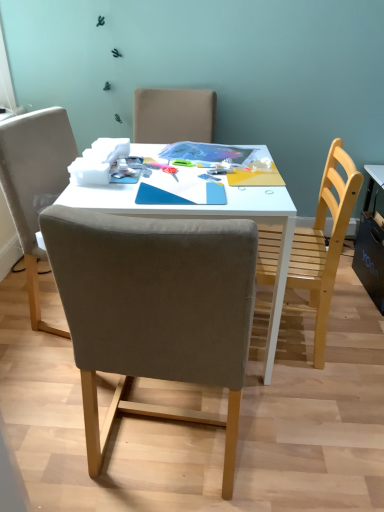
The image size is (384, 512). What do you see at coordinates (210, 218) in the screenshot? I see `white glossy table at center` at bounding box center [210, 218].

Identify the location of wooden chair at right, the 1th chair viewed from the right. Image resolution: width=384 pixels, height=512 pixels. (324, 242).

From the picture: From the image's perspective, which is above, wooden chair at right, the 1th chair viewed from the right, or white glossy table at center?

wooden chair at right, the 1th chair viewed from the right, appears higher in the image.

From a real-world perspective, is wooden chair at right, positioned as the second chair in left-to-right order, positioned over white glossy table at center based on gravity?

Yes, from a real-world perspective, wooden chair at right, positioned as the second chair in left-to-right order, is above white glossy table at center.

In the image, there is a wooden chair at right, positioned as the second chair in left-to-right order. Where is `table below it (from the image's perspective)`? table below it (from the image's perspective) is located at coordinates (210, 218).

Considering the relative positions of white glossy table at center and wooden chair at right, the 1th chair viewed from the right, in the image provided, is white glossy table at center to the left of wooden chair at right, the 1th chair viewed from the right, from the viewer's perspective?

Indeed, white glossy table at center is positioned on the left side of wooden chair at right, the 1th chair viewed from the right.

Is white glossy table at center completely or partially outside of wooden chair at right, the 1th chair viewed from the right?

That's correct, white glossy table at center is outside of wooden chair at right, the 1th chair viewed from the right.

Considering the sizes of objects white glossy table at center and wooden chair at right, the 1th chair viewed from the right, in the image provided, who is taller, white glossy table at center or wooden chair at right, the 1th chair viewed from the right,?

With more height is wooden chair at right, the 1th chair viewed from the right.

Is white glossy table at center smaller than wooden chair at right, the 1th chair viewed from the right?

No.

Is suede-like beige chair at center, which is the second chair from right to left, in front of white glossy table at center?

Yes, it is.

Do you think suede-like beige chair at center, acting as the 1th chair starting from the left, is within white glossy table at center, or outside of it?

suede-like beige chair at center, acting as the 1th chair starting from the left, exists outside the volume of white glossy table at center.

In terms of size, does suede-like beige chair at center, which is the second chair from right to left, appear bigger or smaller than white glossy table at center?

Clearly, suede-like beige chair at center, which is the second chair from right to left, is smaller in size than white glossy table at center.

Which object is positioned more to the left, suede-like beige chair at center, which is the second chair from right to left, or white glossy table at center?

suede-like beige chair at center, which is the second chair from right to left.

Would you say wooden chair at right, positioned as the second chair in left-to-right order, contains suede-like beige chair at center, which is the second chair from right to left?

No, suede-like beige chair at center, which is the second chair from right to left, is not surrounded by wooden chair at right, positioned as the second chair in left-to-right order.

Between wooden chair at right, positioned as the second chair in left-to-right order, and suede-like beige chair at center, which is the second chair from right to left, which one has larger size?

With larger size is suede-like beige chair at center, which is the second chair from right to left.

Is wooden chair at right, the 1th chair viewed from the right, oriented away from suede-like beige chair at center, which is the second chair from right to left?

No, suede-like beige chair at center, which is the second chair from right to left, is not at the back of wooden chair at right, the 1th chair viewed from the right.

How distant is wooden chair at right, positioned as the second chair in left-to-right order, from suede-like beige chair at center, which is the second chair from right to left?

They are 26.28 inches apart.

Can you tell me how much white glossy table at center and suede-like beige chair at center, which is the second chair from right to left, differ in facing direction?

There is a 172-degree angle between the facing directions of white glossy table at center and suede-like beige chair at center, which is the second chair from right to left.

Looking at this image, between white glossy table at center and suede-like beige chair at center, acting as the 1th chair starting from the left, which one has more height?

With more height is suede-like beige chair at center, acting as the 1th chair starting from the left.

From a real-world perspective, which object rests below the other?

white glossy table at center.

Considering the points (153, 145) and (115, 319), which point is in front, point (153, 145) or point (115, 319)?

Point (115, 319)

From the image's perspective, is suede-like beige chair at center, acting as the 1th chair starting from the left, located beneath wooden chair at right, the 1th chair viewed from the right?

Yes, from the image's perspective, suede-like beige chair at center, acting as the 1th chair starting from the left, is below wooden chair at right, the 1th chair viewed from the right.

Is suede-like beige chair at center, acting as the 1th chair starting from the left, oriented towards wooden chair at right, positioned as the second chair in left-to-right order?

No, suede-like beige chair at center, acting as the 1th chair starting from the left, does not turn towards wooden chair at right, positioned as the second chair in left-to-right order.

Is the position of suede-like beige chair at center, acting as the 1th chair starting from the left, less distant than that of wooden chair at right, the 1th chair viewed from the right?

Yes.

The height and width of the screenshot is (512, 384). I want to click on chair above the white glossy table at center (from the image's perspective), so click(x=324, y=242).

At what (x,y) coordinates should I click in order to perform the action: click on table lying below the wooden chair at right, positioned as the second chair in left-to-right order (from the image's perspective). Please return your answer as a coordinate pair (x, y). The width and height of the screenshot is (384, 512). Looking at the image, I should click on (210, 218).

Based on their spatial positions, is wooden chair at right, positioned as the second chair in left-to-right order, or suede-like beige chair at center, acting as the 1th chair starting from the left, closer to white glossy table at center?

wooden chair at right, positioned as the second chair in left-to-right order, is positioned closer to the anchor white glossy table at center.

Based on their spatial positions, is white glossy table at center or suede-like beige chair at center, acting as the 1th chair starting from the left, further from wooden chair at right, positioned as the second chair in left-to-right order?

Based on the image, suede-like beige chair at center, acting as the 1th chair starting from the left, appears to be further to wooden chair at right, positioned as the second chair in left-to-right order.

Considering their positions, is suede-like beige chair at center, acting as the 1th chair starting from the left, positioned further to wooden chair at right, the 1th chair viewed from the right, than white glossy table at center?

suede-like beige chair at center, acting as the 1th chair starting from the left, lies further to wooden chair at right, the 1th chair viewed from the right, than the other object.

Based on the photo, from the image, which object appears to be nearer to suede-like beige chair at center, which is the second chair from right to left, white glossy table at center or wooden chair at right, the 1th chair viewed from the right?

white glossy table at center.

When comparing their distances from white glossy table at center, does suede-like beige chair at center, which is the second chair from right to left, or wooden chair at right, positioned as the second chair in left-to-right order, seem closer?

The object closer to white glossy table at center is wooden chair at right, positioned as the second chair in left-to-right order.

Looking at the image, which one is located closer to suede-like beige chair at center, acting as the 1th chair starting from the left, wooden chair at right, the 1th chair viewed from the right, or white glossy table at center?

white glossy table at center is positioned closer to the anchor suede-like beige chair at center, acting as the 1th chair starting from the left.

Locate an element on the screen. table between suede-like beige chair at center, acting as the 1th chair starting from the left, and wooden chair at right, positioned as the second chair in left-to-right order, from front to back is located at coordinates (210, 218).